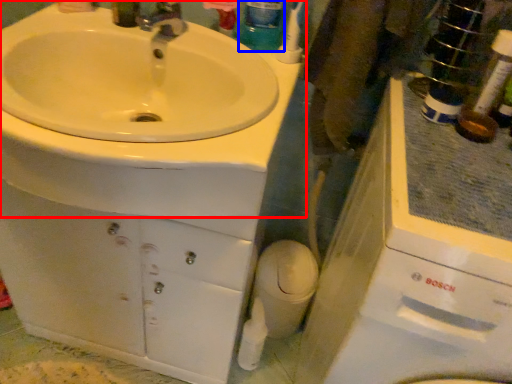
Question: Which object is closer to the camera taking this photo, sink (highlighted by a red box) or mouthwash (highlighted by a blue box)?

Choices:
 (A) sink
 (B) mouthwash

Answer: (A)